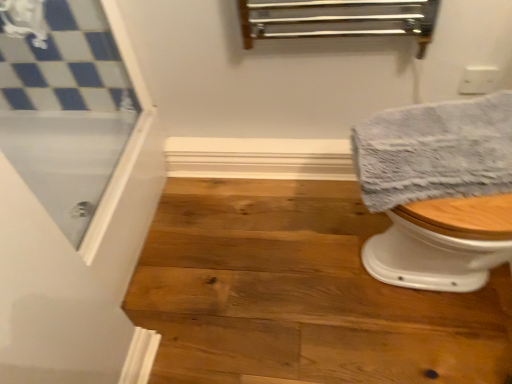
Question: Is clear glass screen door at upper left positioned with its back to gray textured towel at right?

Choices:
 (A) yes
 (B) no

Answer: (B)

Question: Considering the relative sizes of clear glass screen door at upper left and gray textured towel at right in the image provided, is clear glass screen door at upper left thinner than gray textured towel at right?

Choices:
 (A) yes
 (B) no

Answer: (A)

Question: Are clear glass screen door at upper left and gray textured towel at right far apart?

Choices:
 (A) yes
 (B) no

Answer: (B)

Question: From a real-world perspective, is clear glass screen door at upper left physically above gray textured towel at right?

Choices:
 (A) no
 (B) yes

Answer: (B)

Question: Is clear glass screen door at upper left aimed at gray textured towel at right?

Choices:
 (A) no
 (B) yes

Answer: (B)

Question: Is clear glass screen door at upper left outside gray textured towel at right?

Choices:
 (A) yes
 (B) no

Answer: (A)

Question: Is clear glass screen door at upper left with natural wood stair at lower right?

Choices:
 (A) no
 (B) yes

Answer: (A)

Question: Can you confirm if clear glass screen door at upper left is thinner than natural wood stair at lower right?

Choices:
 (A) yes
 (B) no

Answer: (A)

Question: From the image's perspective, is clear glass screen door at upper left below natural wood stair at lower right?

Choices:
 (A) yes
 (B) no

Answer: (B)

Question: Considering the relative sizes of clear glass screen door at upper left and natural wood stair at lower right in the image provided, is clear glass screen door at upper left taller than natural wood stair at lower right?

Choices:
 (A) no
 (B) yes

Answer: (B)

Question: From the image's perspective, is clear glass screen door at upper left on top of natural wood stair at lower right?

Choices:
 (A) no
 (B) yes

Answer: (B)

Question: Is clear glass screen door at upper left to the left of natural wood stair at lower right from the viewer's perspective?

Choices:
 (A) yes
 (B) no

Answer: (A)

Question: Can you confirm if natural wood stair at lower right is bigger than gray textured towel at right?

Choices:
 (A) no
 (B) yes

Answer: (B)